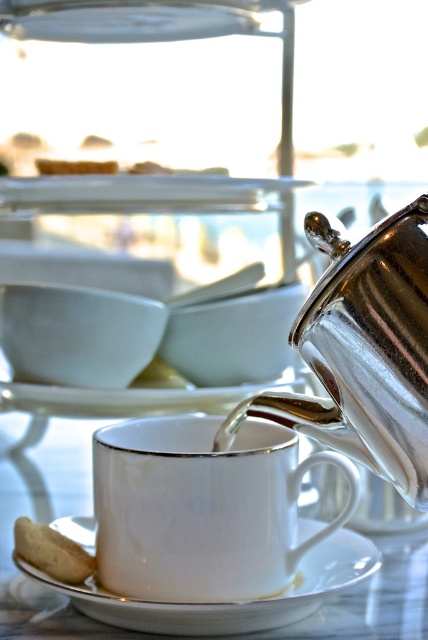
Between white porcelain plate at center and green matte cookie at center, which one is positioned higher?

Positioned higher is green matte cookie at center.

Can you confirm if white porcelain plate at center is positioned to the left of green matte cookie at center?

In fact, white porcelain plate at center is to the right of green matte cookie at center.

Who is more forward, (x=98, y=401) or (x=68, y=168)?

Point (x=98, y=401) is more forward.

Identify the location of white porcelain plate at center. (136, 397).

Consider the image. Can you confirm if white porcelain plate at center is thinner than white fluffy bread at lower left?

No.

Which of these two, white porcelain plate at center or white fluffy bread at lower left, stands shorter?

With less height is white fluffy bread at lower left.

You are a GUI agent. You are given a task and a screenshot of the screen. Output one action in this format:
    pyautogui.click(x=<x>, y=<y>)
    Task: Click on the white porcelain plate at center
    
    Given the screenshot: What is the action you would take?
    pyautogui.click(x=136, y=397)

Which is more to the left, shiny metallic teapot at center or white porcelain plate at center?

white porcelain plate at center is more to the left.

From the picture: Does shiny metallic teapot at center have a greater height compared to white porcelain plate at center?

Indeed, shiny metallic teapot at center has a greater height compared to white porcelain plate at center.

At what (x,y) coordinates should I click in order to perform the action: click on shiny metallic teapot at center. Please return your answer as a coordinate pair (x, y). Looking at the image, I should click on (362, 352).